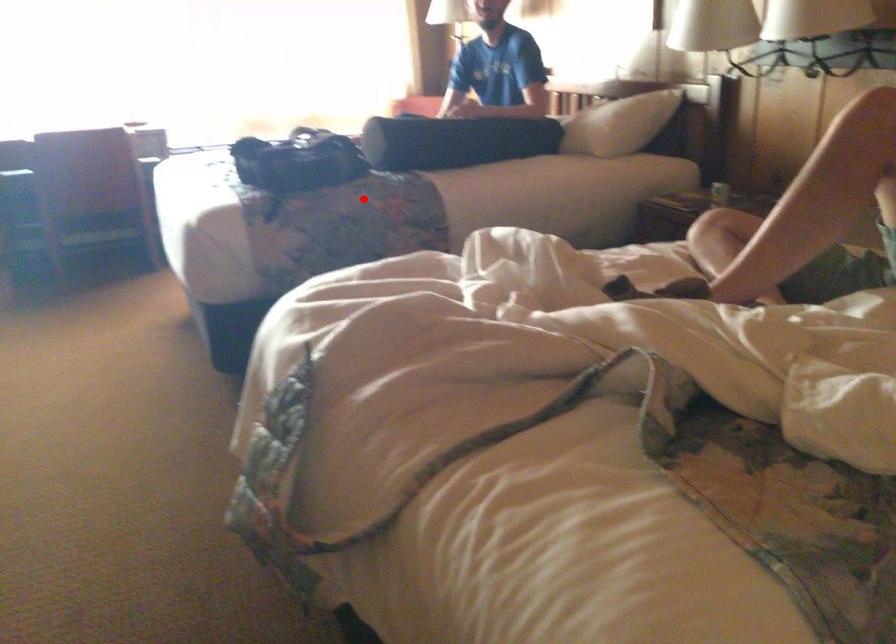
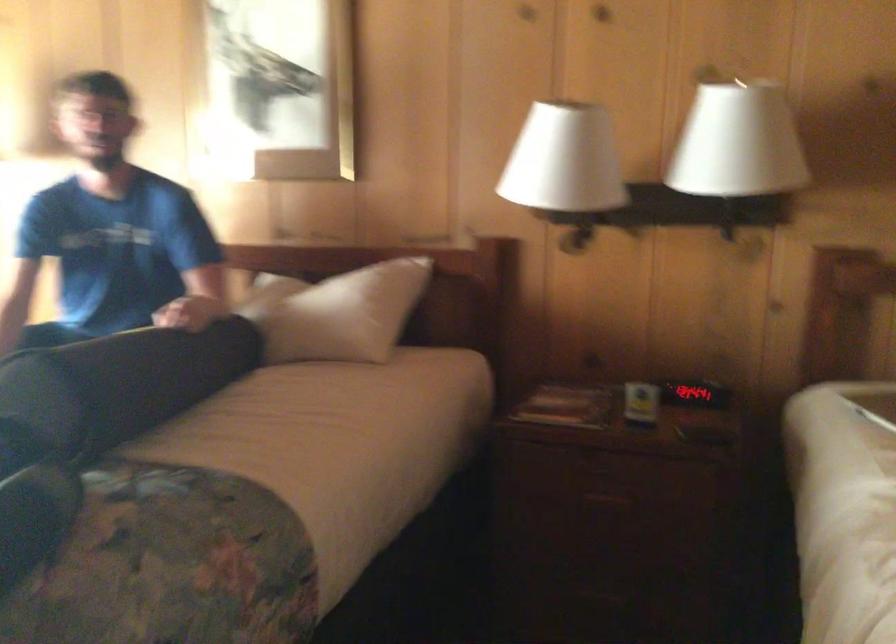
Find the pixel in the second image that matches the highlighted location in the first image.

(170, 565)